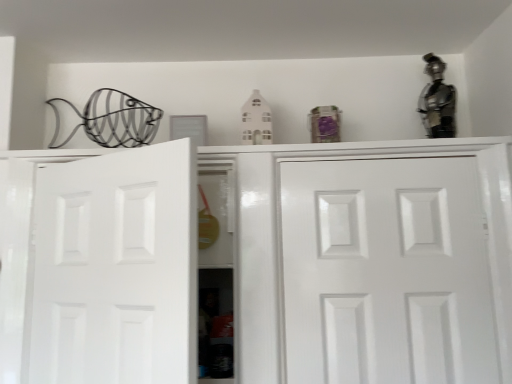
Question: Should I look upward or downward to see white matte door at left, the 2th door positioned from the right?

Choices:
 (A) up
 (B) down

Answer: (B)

Question: Is metallic silver figurine at upper right oriented away from white glossy door at center, the 2th door in the left-to-right sequence?

Choices:
 (A) yes
 (B) no

Answer: (B)

Question: Is metallic silver figurine at upper right bigger than white glossy door at center, the 1th door when ordered from right to left?

Choices:
 (A) yes
 (B) no

Answer: (B)

Question: From the image's perspective, is metallic silver figurine at upper right located beneath white glossy door at center, the 2th door in the left-to-right sequence?

Choices:
 (A) yes
 (B) no

Answer: (B)

Question: Is metallic silver figurine at upper right closer to the viewer compared to white glossy door at center, the 2th door in the left-to-right sequence?

Choices:
 (A) no
 (B) yes

Answer: (A)

Question: From a real-world perspective, is metallic silver figurine at upper right below white glossy door at center, the 2th door in the left-to-right sequence?

Choices:
 (A) no
 (B) yes

Answer: (A)

Question: Is metallic silver figurine at upper right not inside white glossy door at center, the 1th door when ordered from right to left?

Choices:
 (A) yes
 (B) no

Answer: (A)

Question: Is white glossy door at center, the 1th door when ordered from right to left, closer to camera compared to white matte door at left, the 2th door positioned from the right?

Choices:
 (A) yes
 (B) no

Answer: (B)

Question: Is white glossy door at center, the 1th door when ordered from right to left, at the left side of white matte door at left, arranged as the first door when viewed from the left?

Choices:
 (A) yes
 (B) no

Answer: (B)

Question: From the image's perspective, would you say white glossy door at center, the 2th door in the left-to-right sequence, is shown under white matte door at left, the 2th door positioned from the right?

Choices:
 (A) no
 (B) yes

Answer: (B)

Question: Considering the relative sizes of white glossy door at center, the 2th door in the left-to-right sequence, and white matte door at left, arranged as the first door when viewed from the left, in the image provided, is white glossy door at center, the 2th door in the left-to-right sequence, wider than white matte door at left, arranged as the first door when viewed from the left,?

Choices:
 (A) yes
 (B) no

Answer: (A)

Question: Would you say white glossy door at center, the 1th door when ordered from right to left, is outside white matte door at left, the 2th door positioned from the right?

Choices:
 (A) yes
 (B) no

Answer: (A)

Question: Can you confirm if white glossy door at center, the 1th door when ordered from right to left, is bigger than white matte door at left, the 2th door positioned from the right?

Choices:
 (A) yes
 (B) no

Answer: (A)

Question: Is there a large distance between white glossy door at center, the 1th door when ordered from right to left, and metallic silver figurine at upper right?

Choices:
 (A) yes
 (B) no

Answer: (B)